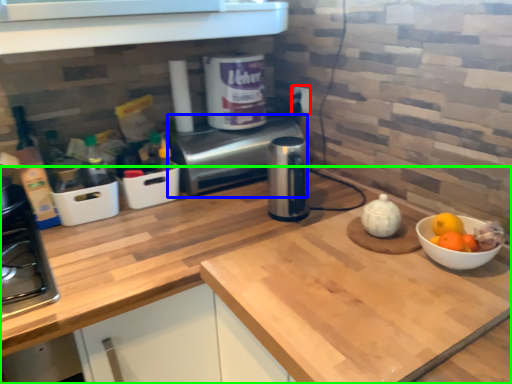
Question: Which is farther away from electric outlet (highlighted by a red box)? oven (highlighted by a blue box) or countertop (highlighted by a green box)?

Choices:
 (A) oven
 (B) countertop

Answer: (B)